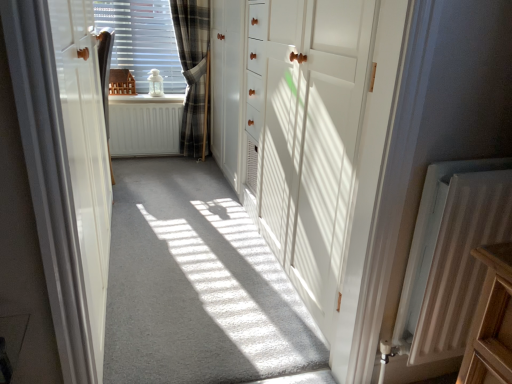
You are a GUI agent. You are given a task and a screenshot of the screen. Output one action in this format:
    pyautogui.click(x=<x>, y=<y>)
    Task: Click on the vacant area in front of plaid fabric curtain at center, which appears as the 1th curtain when viewed from the right
    The height and width of the screenshot is (384, 512).
    Given the screenshot: What is the action you would take?
    pyautogui.click(x=180, y=170)